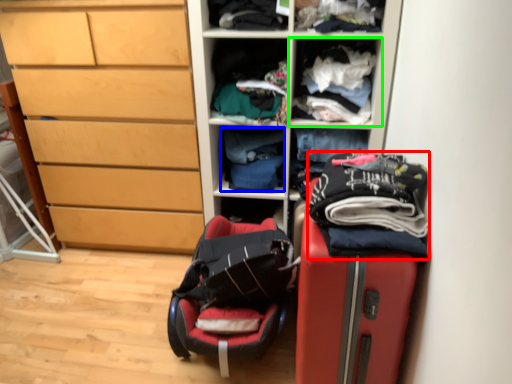
Question: Based on their relative distances, which object is farther from clothing (highlighted by a red box)? Choose from clothing (highlighted by a blue box) and shelf (highlighted by a green box).

Choices:
 (A) clothing
 (B) shelf

Answer: (A)